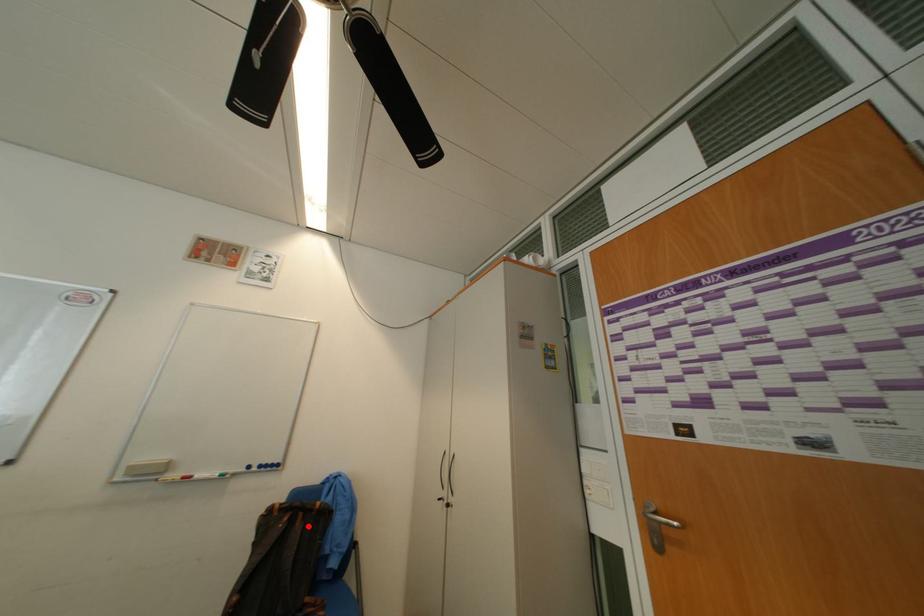
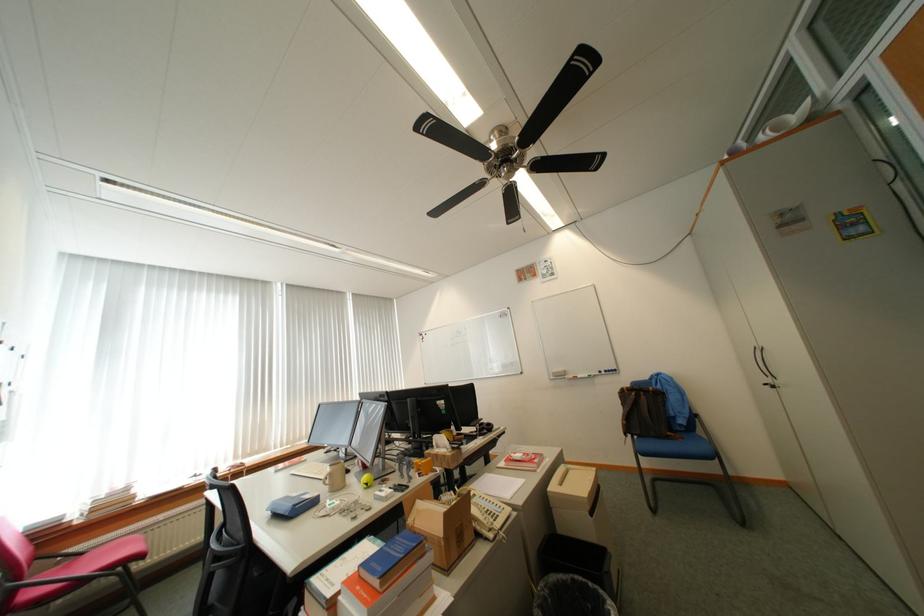
In the second image, find the point that corresponds to the highlighted location in the first image.

(652, 399)